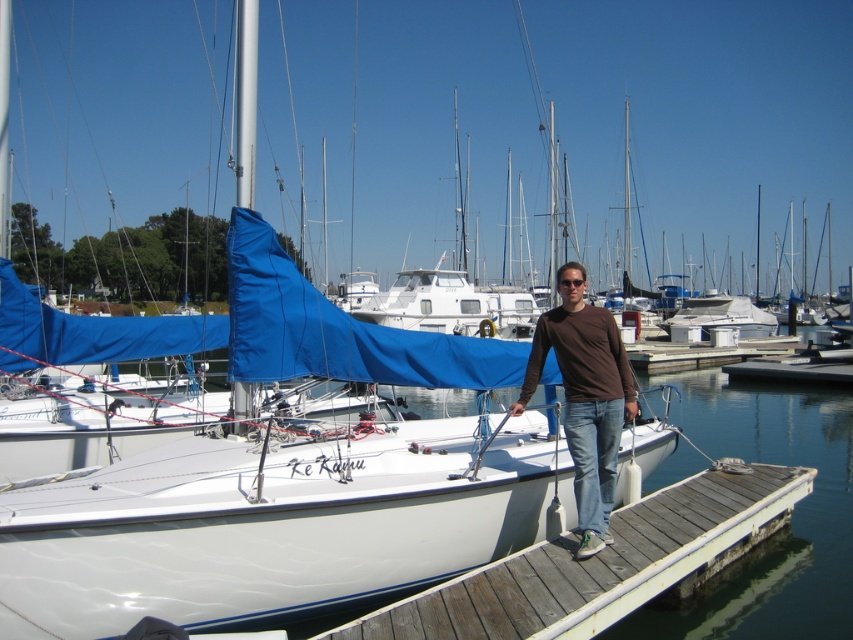
Does wooden dock at center have a greater height compared to brown cotton shirt at center?

No, wooden dock at center is not taller than brown cotton shirt at center.

Is wooden dock at center positioned at the back of brown cotton shirt at center?

No, it is in front of brown cotton shirt at center.

Is point (700, 518) farther from camera compared to point (582, 512)?

Yes, point (700, 518) is behind point (582, 512).

I want to click on wooden dock at center, so click(602, 564).

The height and width of the screenshot is (640, 853). What do you see at coordinates (602, 564) in the screenshot? I see `wooden dock at center` at bounding box center [602, 564].

Can you confirm if wooden dock at center is shorter than wooden at center?

Yes, wooden dock at center is shorter than wooden at center.

Is point (798, 467) positioned behind point (653, 364)?

That is False.

The height and width of the screenshot is (640, 853). Find the location of `wooden dock at center`. wooden dock at center is located at coordinates (602, 564).

Does brown cotton shirt at center have a greater width compared to wooden at center?

No, brown cotton shirt at center is not wider than wooden at center.

Can you confirm if brown cotton shirt at center is bigger than wooden at center?

Actually, brown cotton shirt at center might be smaller than wooden at center.

Image resolution: width=853 pixels, height=640 pixels. What are the coordinates of `brown cotton shirt at center` in the screenshot? It's located at (585, 397).